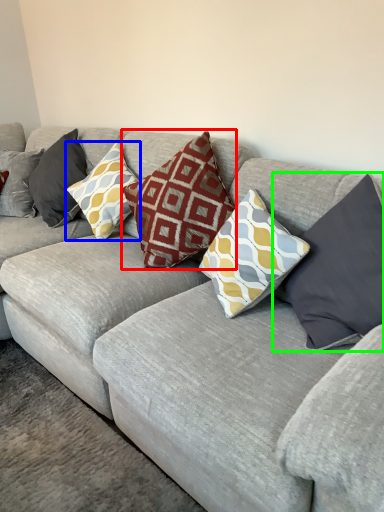
Question: Which object is the closest to the pillow (highlighted by a red box)? Choose among these: pillow (highlighted by a blue box) or pillow (highlighted by a green box).

Choices:
 (A) pillow
 (B) pillow

Answer: (A)